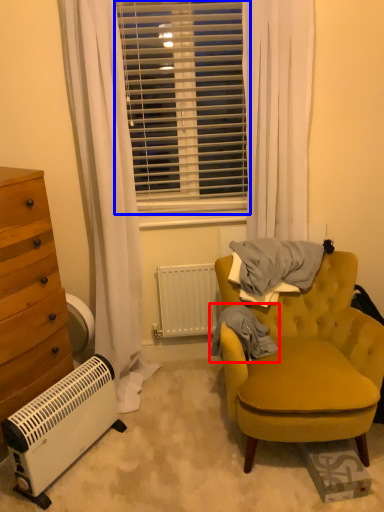
Question: Among these objects, which one is farthest to the camera, blanket (highlighted by a red box) or window blind (highlighted by a blue box)?

Choices:
 (A) blanket
 (B) window blind

Answer: (B)